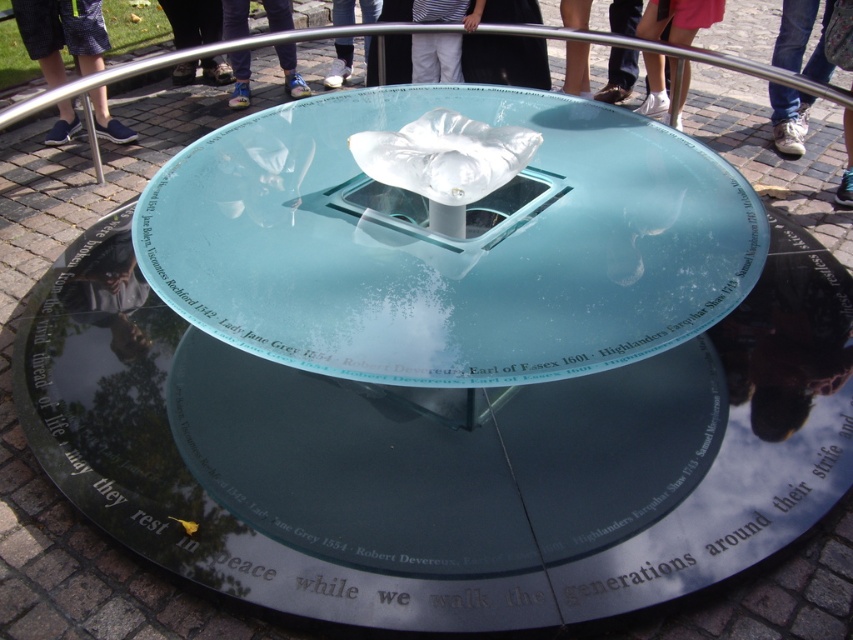
You are standing in front of the memorial structure and want to touch the point at coordinates point (x=531, y=301). Can you reach it without moving your feet?

The point (x=531, y=301) is 6.62 feet away from you, so you cannot reach it without moving your feet since it is too far.

You are standing at the edge of the memorial structure and notice both the transparent glass table at center and the white fabric shoe at lower center. Which object is located to the right of the other?

The transparent glass table at center is positioned on the right side of white fabric shoe at lower center.